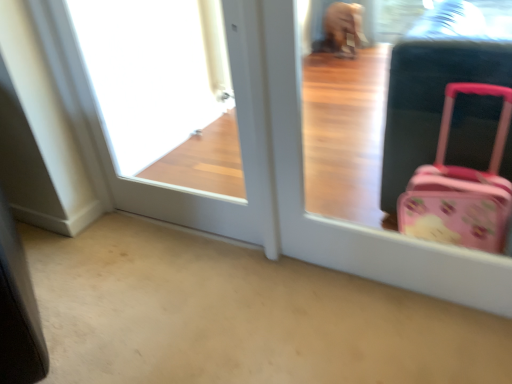
This screenshot has width=512, height=384. What do you see at coordinates (164, 89) in the screenshot?
I see `white glossy door at upper left` at bounding box center [164, 89].

I want to click on white glossy door at upper left, so click(x=164, y=89).

This screenshot has height=384, width=512. What do you see at coordinates (356, 225) in the screenshot?
I see `pink plastic suitcase at right` at bounding box center [356, 225].

I want to click on pink plastic suitcase at right, so click(356, 225).

Where is `white glossy door at upper left`? The width and height of the screenshot is (512, 384). white glossy door at upper left is located at coordinates (164, 89).

Which is more to the left, white glossy door at upper left or pink plastic suitcase at right?

white glossy door at upper left.

Does white glossy door at upper left lie behind pink plastic suitcase at right?

That is True.

Does point (215, 104) come farther from viewer compared to point (335, 234)?

Yes, point (215, 104) is behind point (335, 234).

From the image's perspective, is white glossy door at upper left below pink plastic suitcase at right?

Incorrect, from the image's perspective, white glossy door at upper left is higher than pink plastic suitcase at right.

In the scene shown: From a real-world perspective, is white glossy door at upper left positioned under pink plastic suitcase at right based on gravity?

Incorrect, from a real-world perspective, white glossy door at upper left is higher than pink plastic suitcase at right.

Does white glossy door at upper left have a greater width compared to pink plastic suitcase at right?

No, white glossy door at upper left is not wider than pink plastic suitcase at right.

Is white glossy door at upper left shorter than pink plastic suitcase at right?

No.

Considering the sizes of objects white glossy door at upper left and pink plastic suitcase at right in the image provided, who is bigger, white glossy door at upper left or pink plastic suitcase at right?

white glossy door at upper left.

Would you say white glossy door at upper left is inside or outside pink plastic suitcase at right?

white glossy door at upper left exists outside the volume of pink plastic suitcase at right.

Is white glossy door at upper left next to pink plastic suitcase at right?

white glossy door at upper left is not next to pink plastic suitcase at right, and they're not touching.

Is pink plastic suitcase at right at the back of white glossy door at upper left?

No, white glossy door at upper left is not facing away from pink plastic suitcase at right.

How different are the orientations of white glossy door at upper left and pink plastic suitcase at right in degrees?

The angle between the facing direction of white glossy door at upper left and the facing direction of pink plastic suitcase at right is 0.802 degrees.

I want to click on window frame located behind the pink plastic suitcase at right, so click(x=164, y=89).

From the picture: Considering the relative positions of pink plastic suitcase at right and white glossy door at upper left in the image provided, is pink plastic suitcase at right to the right of white glossy door at upper left from the viewer's perspective?

Yes, pink plastic suitcase at right is to the right of white glossy door at upper left.

Considering their positions, is pink plastic suitcase at right located in front of or behind white glossy door at upper left?

In the image, pink plastic suitcase at right appears in front of white glossy door at upper left.

Which is further, (x=385, y=267) or (x=155, y=111)?

The point (x=155, y=111) is farther from the camera.

From the image's perspective, is pink plastic suitcase at right located beneath white glossy door at upper left?

Correct, pink plastic suitcase at right appears lower than white glossy door at upper left in the image.

From a real-world perspective, which is physically below, pink plastic suitcase at right or white glossy door at upper left?

From a 3D spatial view, pink plastic suitcase at right is below.

Does pink plastic suitcase at right have a lesser width compared to white glossy door at upper left?

No.

Which of these two, pink plastic suitcase at right or white glossy door at upper left, stands taller?

Standing taller between the two is white glossy door at upper left.

Can you confirm if pink plastic suitcase at right is smaller than white glossy door at upper left?

Yes, pink plastic suitcase at right is smaller than white glossy door at upper left.

In the scene shown: Is pink plastic suitcase at right inside or outside of white glossy door at upper left?

pink plastic suitcase at right lies outside white glossy door at upper left.

Is pink plastic suitcase at right in contact with white glossy door at upper left?

pink plastic suitcase at right and white glossy door at upper left are clearly separated.

Does pink plastic suitcase at right turn towards white glossy door at upper left?

No.

How different are the orientations of pink plastic suitcase at right and white glossy door at upper left in degrees?

→ pink plastic suitcase at right and white glossy door at upper left are facing 0.802 degrees away from each other.

Where is `window frame on the left side of pink plastic suitcase at right`? This screenshot has width=512, height=384. window frame on the left side of pink plastic suitcase at right is located at coordinates (164, 89).

Locate an element on the screen. screen door below the white glossy door at upper left (from the image's perspective) is located at coordinates (356, 225).

This screenshot has width=512, height=384. Identify the location of window frame lying behind the pink plastic suitcase at right. (164, 89).